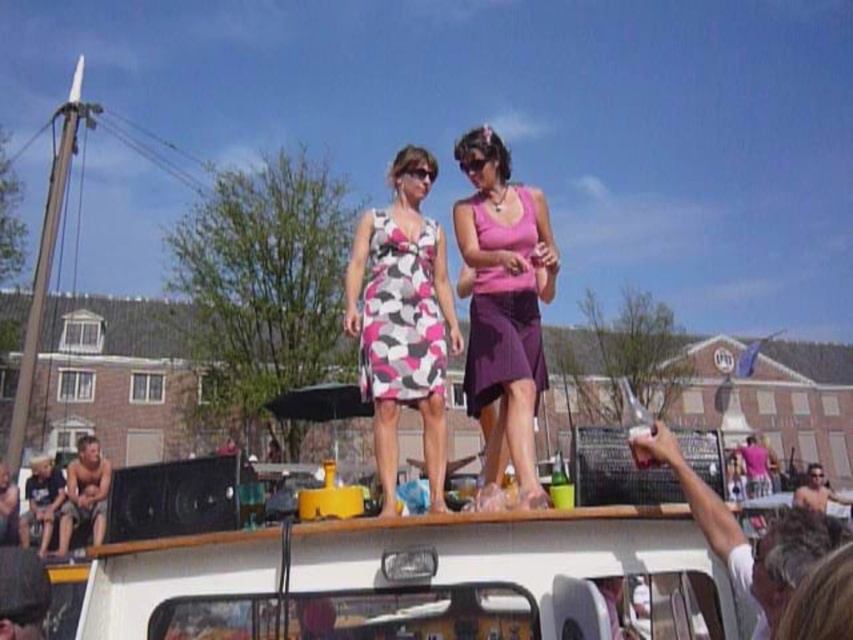
You are a photographer trying to capture a clear shot of the pink and white patterned dress at center and the white plastic pick up at upper center. Since you want to focus on the dress, which object should you zoom in on more to ensure it appears larger in your photo?

The pink and white patterned dress at center has a larger size compared to the white plastic pick up at upper center, so you should zoom in on the pink and white patterned dress at center to make it appear larger in the photo.

You are a photographer trying to capture the two women on the roof of the vehicle. You want to ensure the pink and white patterned dress at center and the white plastic pick up at upper center are both visible in the frame. Based on their positions, which object should you position closer to the left side of your camera viewfinder to include both?

The pink and white patterned dress at center is to the left of the white plastic pick up at upper center, so to include both in the frame, position the pink and white patterned dress at center closer to the left side of the camera viewfinder.

You are a delivery person trying to place a new item on the roof of the white vehicle. You have a small package that needs to be placed between the pink matte tank top at upper center and the white plastic pick up at upper center. Can you fit it there?

The pink matte tank top at upper center is bigger than the white plastic pick up at upper center. Since the package is small, there might be enough space between them to fit it, but you should check the available space carefully.